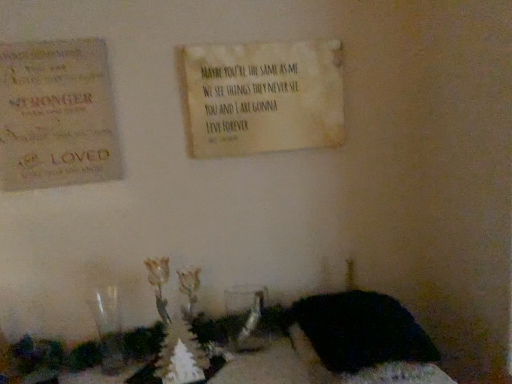
What do you see at coordinates (262, 97) in the screenshot? I see `beige textured sign at upper center` at bounding box center [262, 97].

Where is `black fabric at lower right`? The height and width of the screenshot is (384, 512). black fabric at lower right is located at coordinates (368, 339).

Image resolution: width=512 pixels, height=384 pixels. Describe the element at coordinates (56, 115) in the screenshot. I see `rustic wood sign at upper left` at that location.

Find the location of `beige textured sign at upper center`. beige textured sign at upper center is located at coordinates (262, 97).

Is rustic wood sign at upper left far away from beige textured sign at upper center?

No, rustic wood sign at upper left is in close proximity to beige textured sign at upper center.

Is point (60, 147) closer or farther from the camera than point (208, 101)?

Clearly, point (60, 147) is closer to the camera than point (208, 101).

Which object is positioned more to the left, rustic wood sign at upper left or beige textured sign at upper center?

rustic wood sign at upper left.

Is rustic wood sign at upper left completely or partially outside of beige textured sign at upper center?

Yes, rustic wood sign at upper left is not within beige textured sign at upper center.

Is black fabric at lower right oriented away from rustic wood sign at upper left?

No, black fabric at lower right is not facing away from rustic wood sign at upper left.

You are a GUI agent. You are given a task and a screenshot of the screen. Output one action in this format:
    pyautogui.click(x=<x>, y=<y>)
    Task: Click on the furniture in front of the rustic wood sign at upper left
    
    Given the screenshot: What is the action you would take?
    pyautogui.click(x=368, y=339)

Is black fabric at lower right outside of rustic wood sign at upper left?

Yes.

Looking at this image, from the image's perspective, is black fabric at lower right located beneath rustic wood sign at upper left?

Indeed, from the image's perspective, black fabric at lower right is shown beneath rustic wood sign at upper left.

Is beige textured sign at upper center located within black fabric at lower right?

That's incorrect, beige textured sign at upper center is not inside black fabric at lower right.

Who is taller, black fabric at lower right or beige textured sign at upper center?

beige textured sign at upper center.

Locate an element on the screen. notice behind the black fabric at lower right is located at coordinates (262, 97).

Which object is thinner, black fabric at lower right or beige textured sign at upper center?

With smaller width is beige textured sign at upper center.

Can you tell me how much beige textured sign at upper center and rustic wood sign at upper left differ in facing direction?

beige textured sign at upper center and rustic wood sign at upper left are facing 1.19 degrees away from each other.

From the picture: Does beige textured sign at upper center have a greater height compared to rustic wood sign at upper left?

In fact, beige textured sign at upper center may be shorter than rustic wood sign at upper left.

Is beige textured sign at upper center not within rustic wood sign at upper left?

Yes, beige textured sign at upper center is not within rustic wood sign at upper left.

Find the location of a particular element. Image resolution: width=512 pixels, height=384 pixels. cardboard below the beige textured sign at upper center (from a real-world perspective) is located at coordinates (56, 115).

In the image, there is a black fabric at lower right. At what (x,y) coordinates should I click in order to perform the action: click on cardboard above it (from the image's perspective). Please return your answer as a coordinate pair (x, y). Looking at the image, I should click on (56, 115).

Is rustic wood sign at upper left facing away from black fabric at lower right?

No, rustic wood sign at upper left is not facing away from black fabric at lower right.

Is rustic wood sign at upper left positioned beyond the bounds of black fabric at lower right?

Yes, rustic wood sign at upper left is outside of black fabric at lower right.

Considering the sizes of rustic wood sign at upper left and black fabric at lower right in the image, is rustic wood sign at upper left wider or thinner than black fabric at lower right?

Clearly, rustic wood sign at upper left has less width compared to black fabric at lower right.

From the image's perspective, is beige textured sign at upper center beneath black fabric at lower right?

No, from the image's perspective, beige textured sign at upper center is not beneath black fabric at lower right.

What's the angular difference between beige textured sign at upper center and black fabric at lower right's facing directions?

There is a 1.71-degree angle between the facing directions of beige textured sign at upper center and black fabric at lower right.

The height and width of the screenshot is (384, 512). In the image, there is a black fabric at lower right. Identify the location of notice above it (from the image's perspective). (262, 97).

Consider the image. Based on their sizes in the image, would you say beige textured sign at upper center is bigger or smaller than black fabric at lower right?

In the image, beige textured sign at upper center appears to be smaller than black fabric at lower right.

The height and width of the screenshot is (384, 512). I want to click on notice behind the rustic wood sign at upper left, so click(x=262, y=97).

Locate an element on the screen. furniture below the rustic wood sign at upper left (from the image's perspective) is located at coordinates (368, 339).

Based on their spatial positions, is rustic wood sign at upper left or black fabric at lower right further from beige textured sign at upper center?

The object further to beige textured sign at upper center is black fabric at lower right.

Looking at the image, which one is located further to rustic wood sign at upper left, beige textured sign at upper center or black fabric at lower right?

The object further to rustic wood sign at upper left is black fabric at lower right.

Which object lies further to the anchor point black fabric at lower right, beige textured sign at upper center or rustic wood sign at upper left?

rustic wood sign at upper left is further to black fabric at lower right.

Looking at the image, which one is located closer to black fabric at lower right, rustic wood sign at upper left or beige textured sign at upper center?

beige textured sign at upper center lies closer to black fabric at lower right than the other object.

Considering their positions, is black fabric at lower right positioned closer to beige textured sign at upper center than rustic wood sign at upper left?

rustic wood sign at upper left.

Looking at the image, which one is located closer to rustic wood sign at upper left, black fabric at lower right or beige textured sign at upper center?

beige textured sign at upper center is positioned closer to the anchor rustic wood sign at upper left.

This screenshot has height=384, width=512. In order to click on notice between rustic wood sign at upper left and black fabric at lower right in the horizontal direction in this screenshot , I will do `click(262, 97)`.